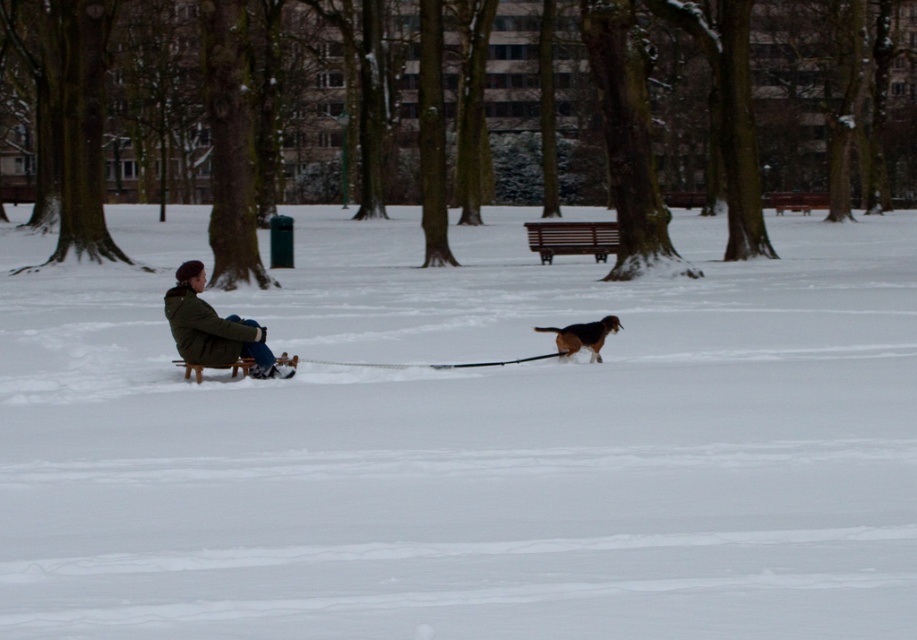
Question: Based on their relative distances, which object is nearer to the brown fur dog at center?

Choices:
 (A) green matte jacket at left
 (B) white fluffy snow at center

Answer: (A)

Question: Can you confirm if white fluffy snow at center is smaller than brown fur dog at center?

Choices:
 (A) no
 (B) yes

Answer: (A)

Question: Observing the image, what is the correct spatial positioning of white fluffy snow at center in reference to green matte jacket at left?

Choices:
 (A) above
 (B) below

Answer: (A)

Question: Which object appears farthest from the camera in this image?

Choices:
 (A) brown fur dog at center
 (B) white fluffy snow at center
 (C) green matte jacket at left

Answer: (A)

Question: Which point appears farthest from the camera in this image?

Choices:
 (A) (569, 324)
 (B) (212, 337)

Answer: (A)

Question: Is white fluffy snow at center positioned behind green matte jacket at left?

Choices:
 (A) no
 (B) yes

Answer: (A)